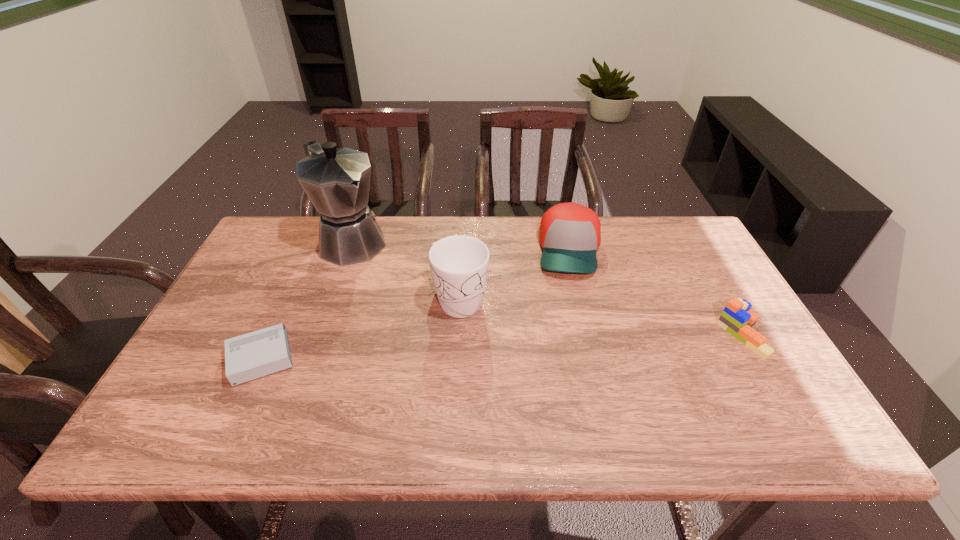
Where is `vacant space located at the spout of the tallest object`? vacant space located at the spout of the tallest object is located at coordinates (396, 287).

Find the location of a particular element. This screenshot has height=540, width=960. vacant space located 0.170m at the spout of the tallest object is located at coordinates (398, 289).

Identify the location of free spot located 0.140m at the spout of the tallest object. The width and height of the screenshot is (960, 540). (393, 284).

What are the coordinates of `free space located on the side of the mug with the handle` in the screenshot? It's located at (530, 376).

Where is `vacant space situated 0.280m on the side of the mug with the handle`? Image resolution: width=960 pixels, height=540 pixels. vacant space situated 0.280m on the side of the mug with the handle is located at coordinates (547, 394).

Identify the location of vacant space located on the side of the mug with the handle. (527, 373).

Image resolution: width=960 pixels, height=540 pixels. In order to click on vacant space located 0.260m at the brim of the third shortest object in this screenshot , I will do `click(576, 353)`.

The height and width of the screenshot is (540, 960). What are the coordinates of `vacant space located at the brim of the third shortest object` in the screenshot? It's located at (577, 369).

At what (x,y) coordinates should I click in order to perform the action: click on free space located 0.240m at the brim of the third shortest object. Please return your answer as a coordinate pair (x, y). Looking at the image, I should click on (576, 346).

Find the location of `coffeepot positioned at the far edge`. coffeepot positioned at the far edge is located at coordinates (337, 181).